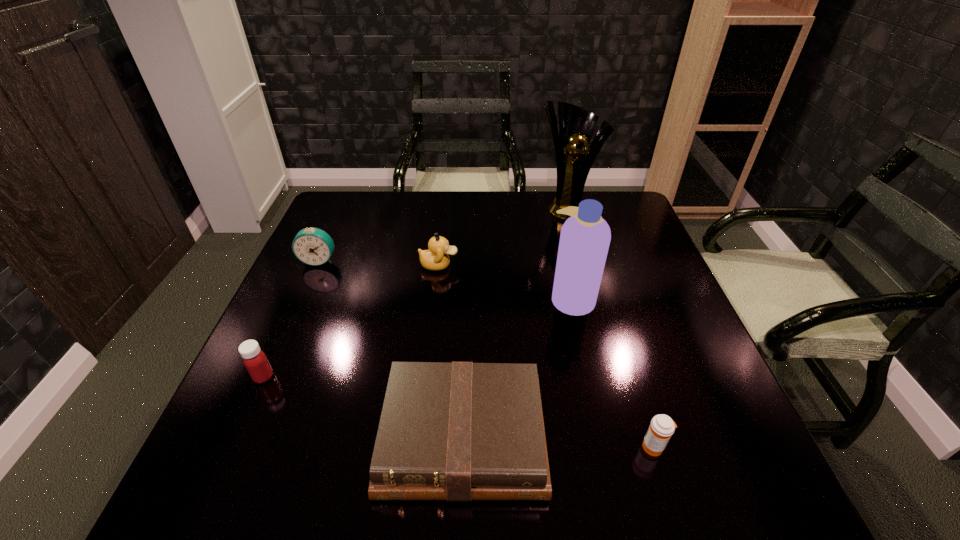
Find the location of a particular element. vacant area that lies between the duckling and the second tallest object is located at coordinates (505, 282).

What are the coordinates of `vacant area that lies between the Bible and the alarm clock` in the screenshot? It's located at (391, 349).

At what (x,y) coordinates should I click in order to perform the action: click on vacant region between the duckling and the nearer medicine. Please return your answer as a coordinate pair (x, y). The image size is (960, 540). Looking at the image, I should click on (546, 356).

What are the coordinates of `vacant area between the duckling and the left medicine` in the screenshot? It's located at (351, 321).

Identify the location of free space between the alarm clock and the fourth farthest object. (445, 280).

What are the coordinates of `vacant space in between the duckling and the alarm clock` in the screenshot? It's located at (379, 262).

This screenshot has width=960, height=540. What are the coordinates of `vacant region between the farther medicine and the Bible` in the screenshot? It's located at (363, 407).

Find the location of a particular element. free spot between the duckling and the alarm clock is located at coordinates tap(379, 262).

The height and width of the screenshot is (540, 960). Find the location of `unoccupied position between the duckling and the Bible`. unoccupied position between the duckling and the Bible is located at coordinates (451, 352).

Find the location of a particular element. This screenshot has height=540, width=960. the third closest object relative to the award is located at coordinates (313, 246).